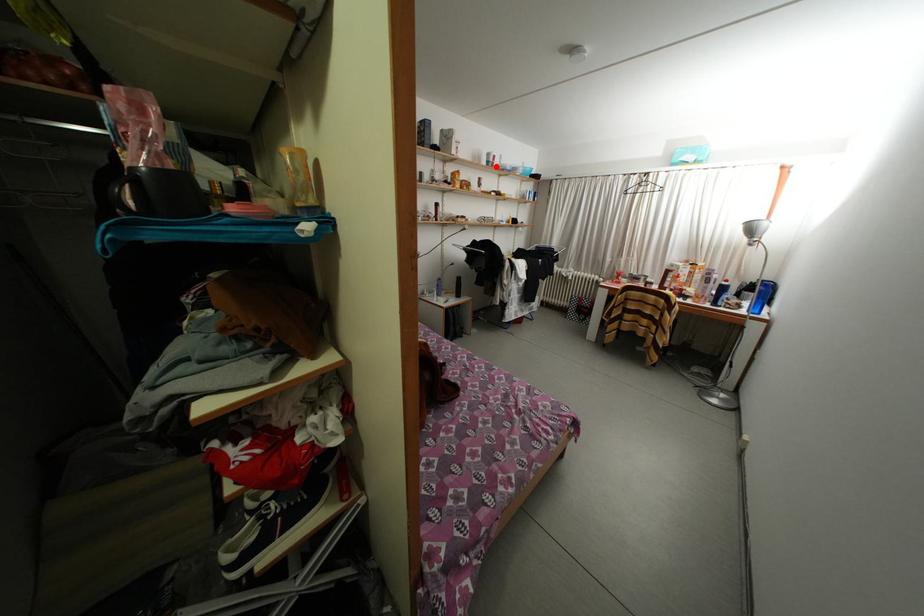
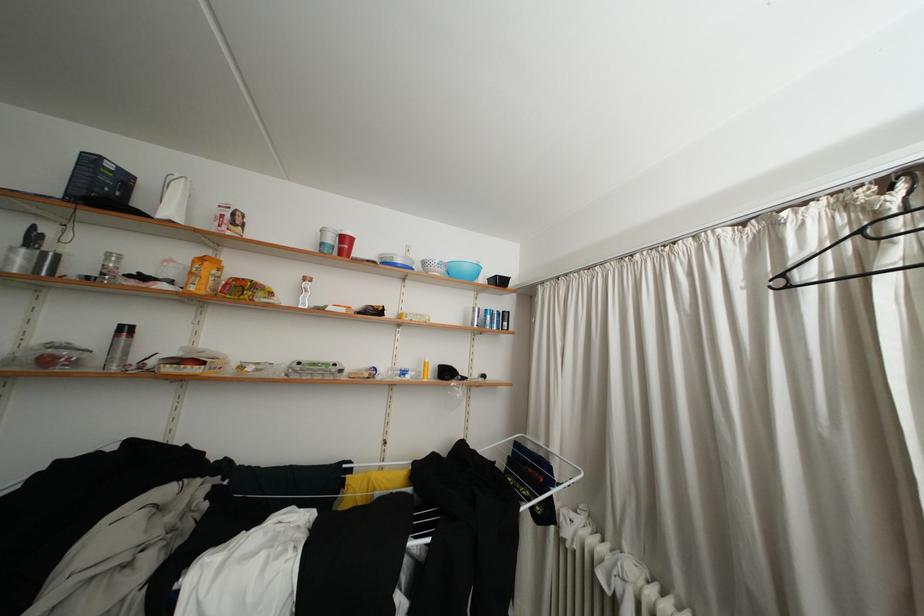
Question: I am providing you with two images of the same scene from different viewpoints. In image1, a red point is highlighted. Considering the same 3D point in image2, which of the following is correct?

Choices:
 (A) It is closer
 (B) It is farther

Answer: (B)